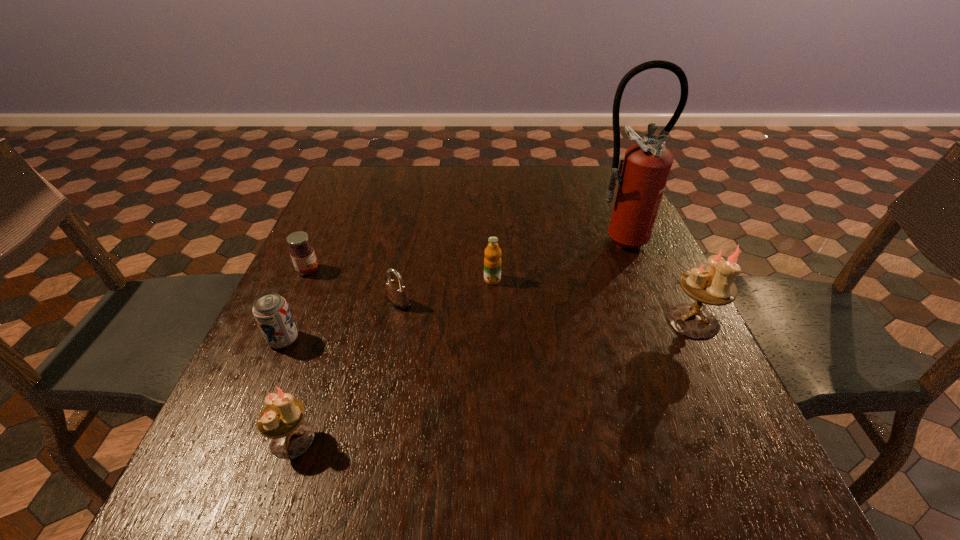
Find the location of `the nearer candle holder`. the nearer candle holder is located at coordinates (281, 420).

You are a GUI agent. You are given a task and a screenshot of the screen. Output one action in this format:
    pyautogui.click(x=<x>, y=<y>)
    Task: Click on the shorter candle holder
    The width and height of the screenshot is (960, 540).
    Given the screenshot: What is the action you would take?
    pyautogui.click(x=281, y=420)

You are a GUI agent. You are given a task and a screenshot of the screen. Output one action in this format:
    pyautogui.click(x=<x>, y=<y>)
    Task: Click on the taller candle holder
    
    Given the screenshot: What is the action you would take?
    pyautogui.click(x=714, y=285)

The height and width of the screenshot is (540, 960). What are the coordinates of `the right candle holder` in the screenshot? It's located at (714, 285).

In order to click on padlock in this screenshot , I will do `click(397, 296)`.

Identify the location of fire extinguisher. Image resolution: width=960 pixels, height=540 pixels. (643, 172).

You are a GUI agent. You are given a task and a screenshot of the screen. Output one action in this format:
    pyautogui.click(x=<x>, y=<y>)
    Task: Click on the farthest object
    The height and width of the screenshot is (540, 960).
    Given the screenshot: What is the action you would take?
    pyautogui.click(x=643, y=172)

This screenshot has width=960, height=540. Identify the location of jam. click(x=302, y=253).

Locate an element on the screen. This screenshot has width=960, height=540. the third object from right to left is located at coordinates (492, 262).

Where is `beer can`? The image size is (960, 540). beer can is located at coordinates (271, 311).